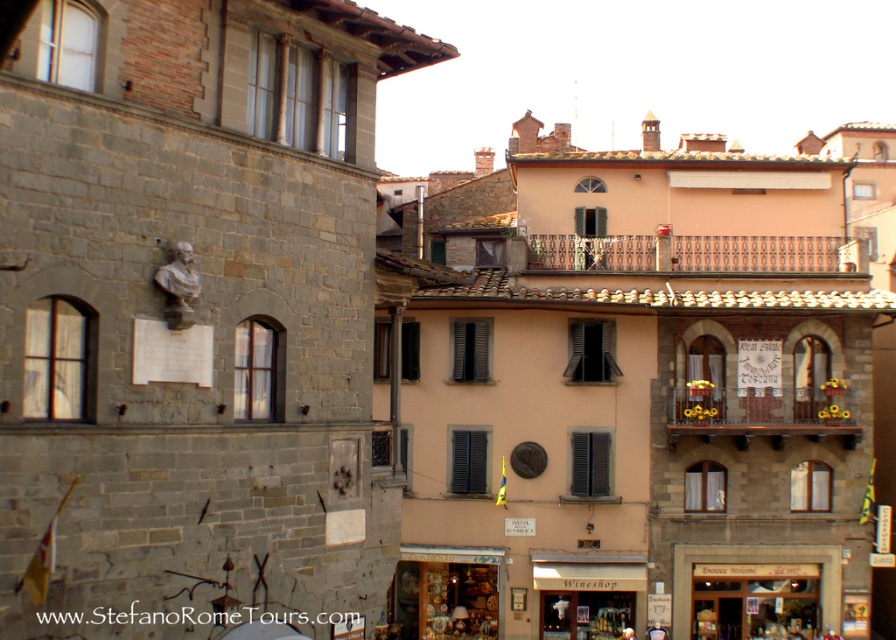
Question: Which of the following is the farthest from the observer?

Choices:
 (A) matte brown wooden wine shop at center
 (B) wooden door at lower right

Answer: (B)

Question: Considering the real-world distances, which object is farthest from the matte ceramic shop at center?

Choices:
 (A) matte brown wooden wine shop at center
 (B) wooden door at lower right

Answer: (B)

Question: Is matte brown wooden wine shop at center bigger than wooden door at lower right?

Choices:
 (A) yes
 (B) no

Answer: (A)

Question: Considering the relative positions of matte ceramic shop at center and matte brown wooden wine shop at center in the image provided, where is matte ceramic shop at center located with respect to matte brown wooden wine shop at center?

Choices:
 (A) right
 (B) left

Answer: (B)

Question: Is matte ceramic shop at center to the left of wooden door at lower right from the viewer's perspective?

Choices:
 (A) no
 (B) yes

Answer: (B)

Question: Which point is closer to the camera taking this photo?

Choices:
 (A) (825, 554)
 (B) (535, 573)
 (C) (468, 621)

Answer: (B)